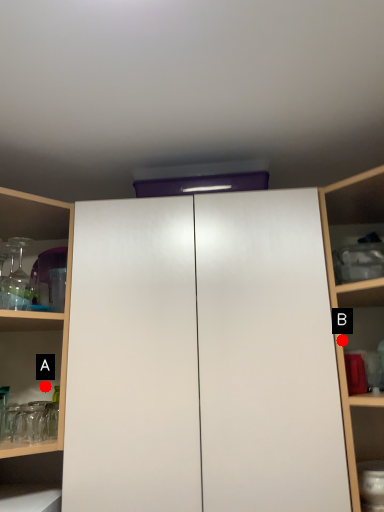
Question: Two points are circled on the image, labeled by A and B beside each circle. Which point appears farthest from the camera in this image?

Choices:
 (A) A is further
 (B) B is further

Answer: (A)